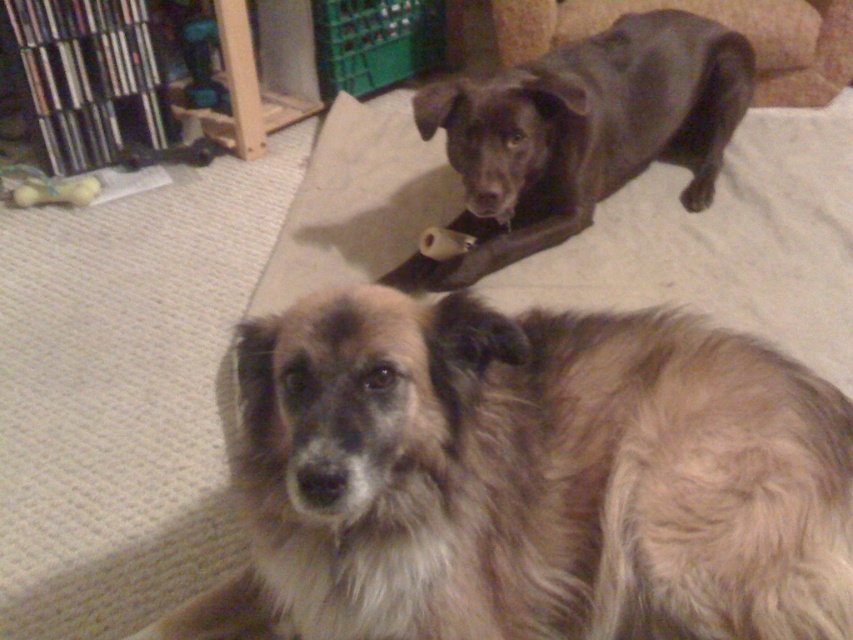
Can you confirm if brown shaggy dog at lower center is positioned to the left of shiny black dog at upper center?

Indeed, brown shaggy dog at lower center is positioned on the left side of shiny black dog at upper center.

From the picture: Is brown shaggy dog at lower center behind shiny black dog at upper center?

No, brown shaggy dog at lower center is closer to the viewer.

Between point (426, 307) and point (627, 154), which one is positioned in front?

Point (426, 307) is more forward.

Find the location of a particular element. This screenshot has height=640, width=853. brown shaggy dog at lower center is located at coordinates (531, 480).